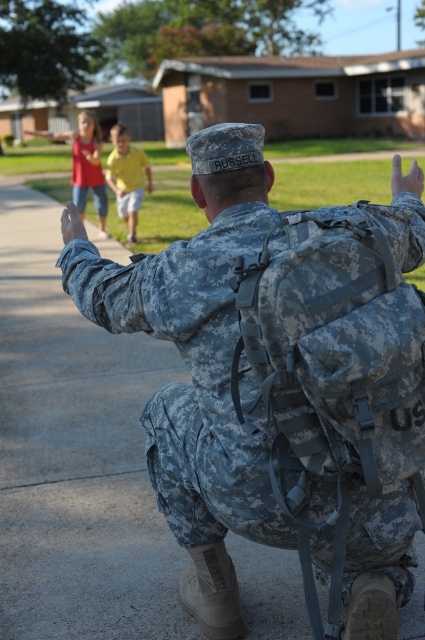
Can you confirm if camouflage fabric uniform at center is smaller than matte camouflage uniform at upper left?

Incorrect, camouflage fabric uniform at center is not smaller in size than matte camouflage uniform at upper left.

Can you confirm if camouflage fabric uniform at center is positioned to the left of matte camouflage uniform at upper left?

No, camouflage fabric uniform at center is not to the left of matte camouflage uniform at upper left.

The image size is (425, 640). In order to click on camouflage fabric uniform at center in this screenshot , I will do `click(195, 364)`.

Find the location of a particular element. camouflage fabric uniform at center is located at coordinates (195, 364).

Is camouflage fabric uniform at center in front of yellow matte shirt at center?

Yes, it is.

Where is `camouflage fabric uniform at center`? camouflage fabric uniform at center is located at coordinates (195, 364).

Image resolution: width=425 pixels, height=640 pixels. What do you see at coordinates (127, 177) in the screenshot?
I see `yellow matte shirt at center` at bounding box center [127, 177].

I want to click on yellow matte shirt at center, so click(x=127, y=177).